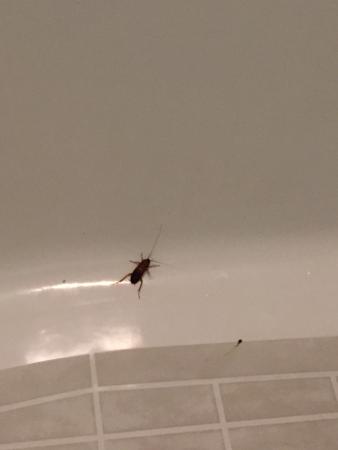
The width and height of the screenshot is (338, 450). Find the location of `bathroom`. bathroom is located at coordinates (266, 372).